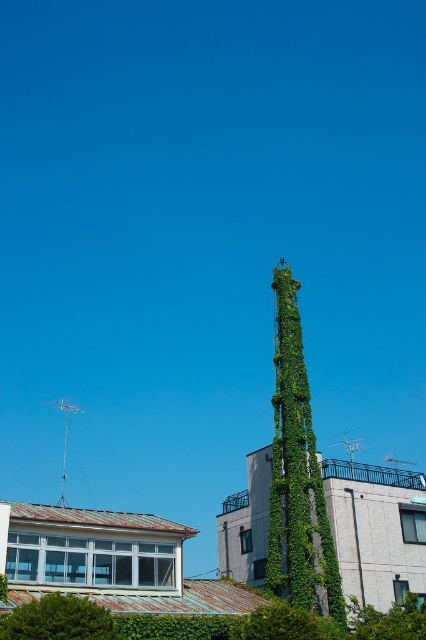
Question: Which point is closer to the camera?

Choices:
 (A) green leafy tree at lower right
 (B) green leafy tree at lower left

Answer: (B)

Question: Does green ivy-covered tower at center appear on the left side of green leafy tree at lower right?

Choices:
 (A) yes
 (B) no

Answer: (A)

Question: Can you confirm if green ivy-covered tower at center is positioned above green leafy tree at lower right?

Choices:
 (A) no
 (B) yes

Answer: (B)

Question: Among these points, which one is nearest to the camera?

Choices:
 (A) (20, 611)
 (B) (419, 609)
 (C) (328, 545)

Answer: (A)

Question: Does green ivy-covered tower at center have a smaller size compared to green leafy tree at lower right?

Choices:
 (A) no
 (B) yes

Answer: (A)

Question: Which object appears closest to the camera in this image?

Choices:
 (A) green leafy tree at lower right
 (B) green ivy-covered tower at center
 (C) green leafy tree at lower left

Answer: (C)